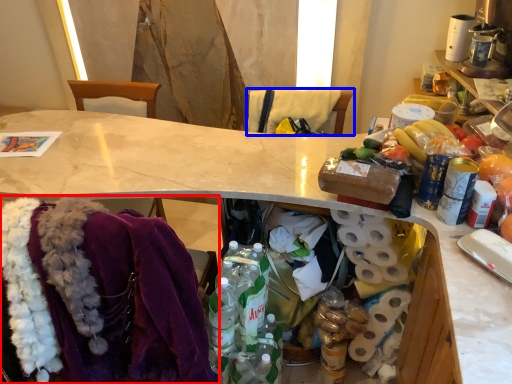
Question: Which object appears closest to the camera in this image, clothing (highlighted by a red box) or leftover (highlighted by a blue box)?

Choices:
 (A) clothing
 (B) leftover

Answer: (A)